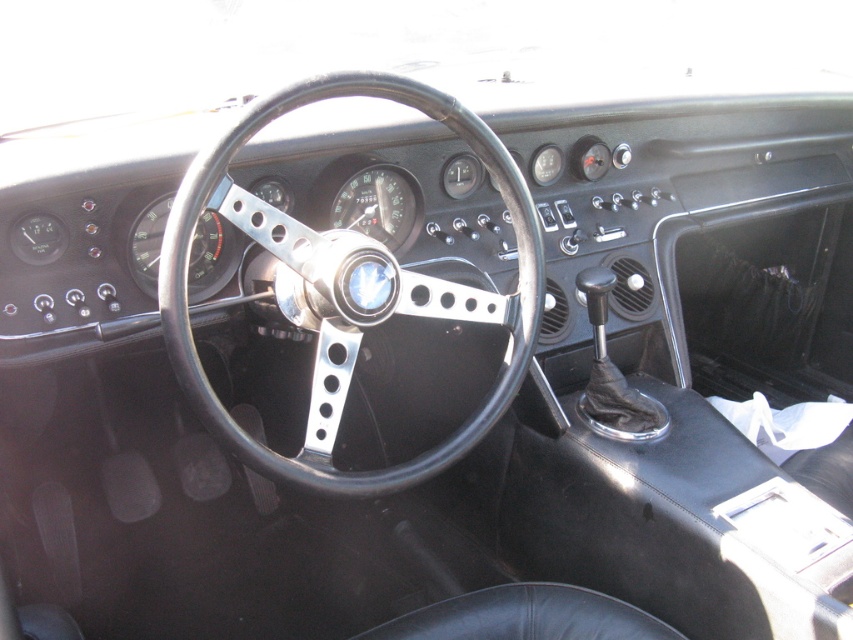
Can you confirm if black leather steering wheel at center is taller than black leather seat at lower center?

Correct, black leather steering wheel at center is much taller as black leather seat at lower center.

Does black leather steering wheel at center appear on the right side of black leather seat at lower center?

In fact, black leather steering wheel at center is to the left of black leather seat at lower center.

Describe the element at coordinates (349, 285) in the screenshot. This screenshot has height=640, width=853. I see `black leather steering wheel at center` at that location.

You are a GUI agent. You are given a task and a screenshot of the screen. Output one action in this format:
    pyautogui.click(x=<x>, y=<y>)
    Task: Click on the black leather steering wheel at center
    The image size is (853, 640).
    Given the screenshot: What is the action you would take?
    pyautogui.click(x=349, y=285)